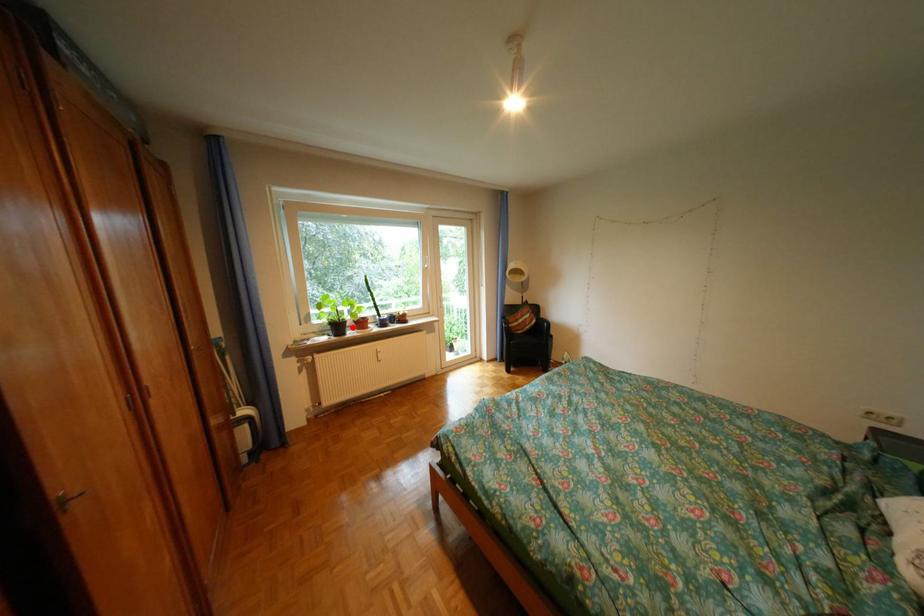
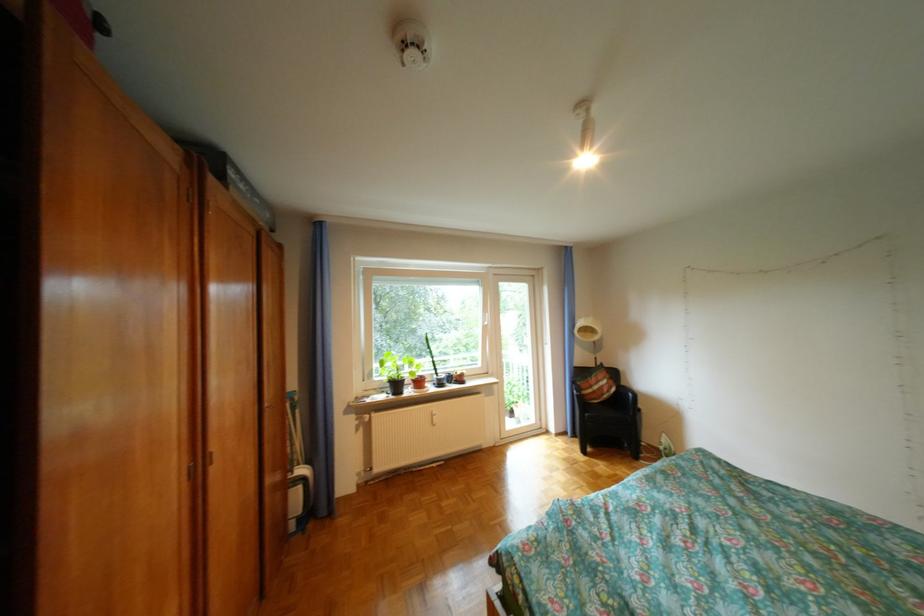
Question: I am providing you with two images of the same scene from different viewpoints. A red point is shown in image1. For the corresponding object point in image2, is it positioned nearer or farther from the camera?

Choices:
 (A) Nearer
 (B) Farther

Answer: (B)